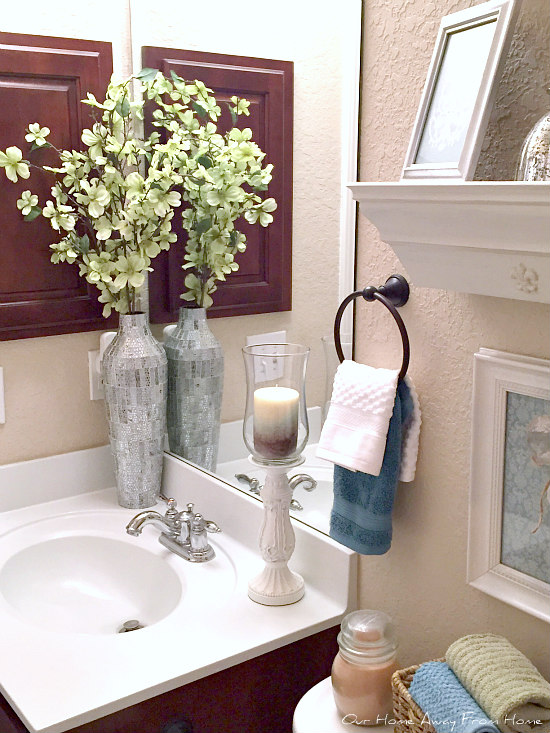
Identify the location of towel. (368, 438), (371, 512), (480, 666), (441, 699).